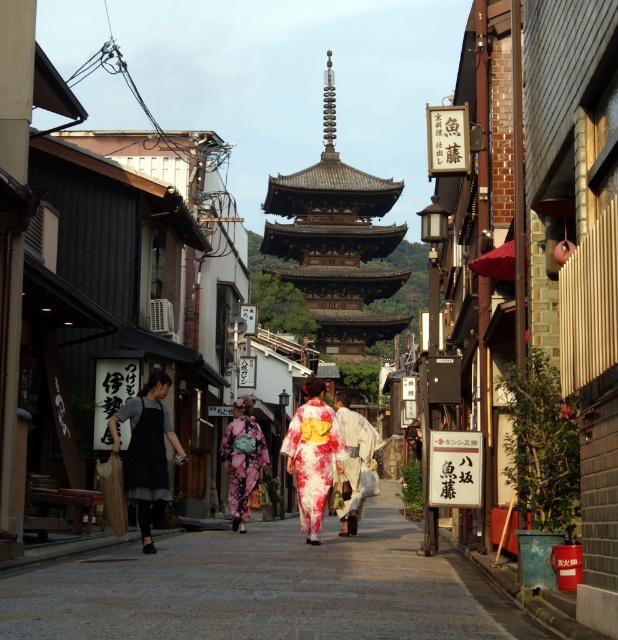
Based on the photo, can you confirm if wooden pagoda at center is bigger than floral silk kimono at center?

Yes, wooden pagoda at center is bigger than floral silk kimono at center.

Is wooden pagoda at center to the right of floral silk kimono at center from the viewer's perspective?

In fact, wooden pagoda at center is to the left of floral silk kimono at center.

Identify the location of wooden pagoda at center. This screenshot has width=618, height=640. (336, 243).

Who is shorter, dark gray apron at left or floral silk kimono at center?

Standing shorter between the two is dark gray apron at left.

Locate an element on the screen. dark gray apron at left is located at coordinates (146, 451).

Can you confirm if wooden pagoda at center is shorter than floral kimono at center?

No, wooden pagoda at center is not shorter than floral kimono at center.

Between wooden pagoda at center and floral kimono at center, which one appears on the right side from the viewer's perspective?

wooden pagoda at center

Does point (375, 250) lie behind point (250, 458)?

That is True.

Identify the location of wooden pagoda at center. (336, 243).